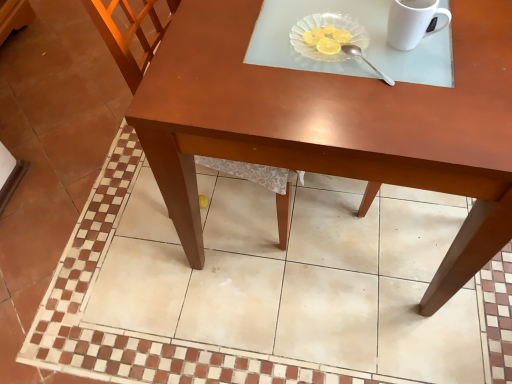
This screenshot has height=384, width=512. Identify the location of free spot in front of wooden chair at center. (220, 323).